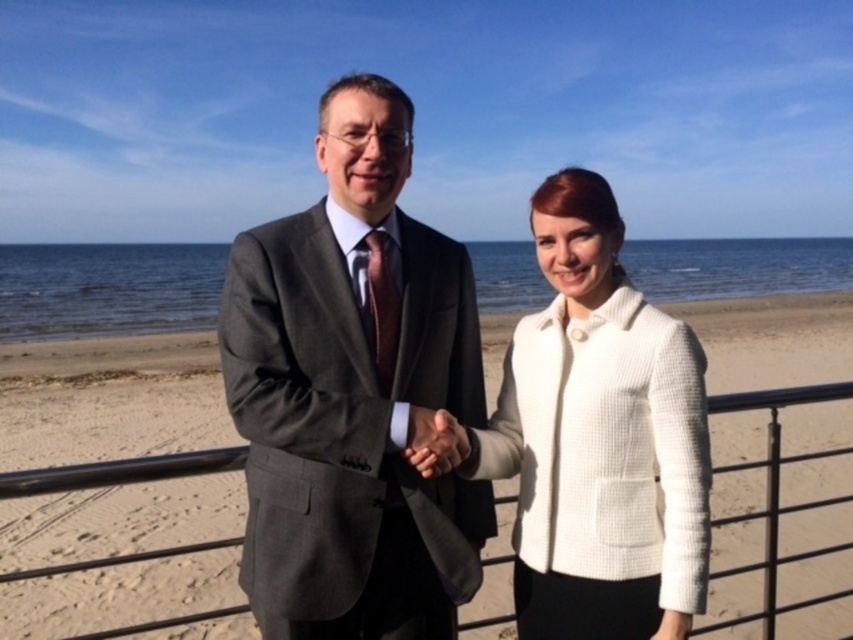
Can you confirm if white textured jacket at center is wider than smooth skin hand at center?

Correct, the width of white textured jacket at center exceeds that of smooth skin hand at center.

Who is shorter, white textured jacket at center or smooth skin hand at center?

smooth skin hand at center

Which is in front, point (573, 524) or point (425, 419)?

Point (425, 419)

Where is `white textured jacket at center`? This screenshot has width=853, height=640. white textured jacket at center is located at coordinates (599, 438).

In the scene shown: Is the position of gray wool suit at center more distant than that of white textured jacket at center?

Yes, gray wool suit at center is further from the viewer.

In the scene shown: Can you confirm if gray wool suit at center is positioned to the right of white textured jacket at center?

Incorrect, gray wool suit at center is not on the right side of white textured jacket at center.

Is point (234, 280) closer to camera compared to point (677, 333)?

No.

Find the location of a particular element. The image size is (853, 640). gray wool suit at center is located at coordinates (352, 394).

Is point (173, 518) behind point (578, 480)?

Yes, point (173, 518) is behind point (578, 480).

Does point (105, 342) come closer to viewer compared to point (544, 214)?

No, (105, 342) is behind (544, 214).

The height and width of the screenshot is (640, 853). Describe the element at coordinates (109, 401) in the screenshot. I see `sandy beach at center` at that location.

You are a GUI agent. You are given a task and a screenshot of the screen. Output one action in this format:
    pyautogui.click(x=<x>, y=<y>)
    Task: Click on the sandy beach at center
    The width and height of the screenshot is (853, 640).
    Given the screenshot: What is the action you would take?
    pyautogui.click(x=109, y=401)